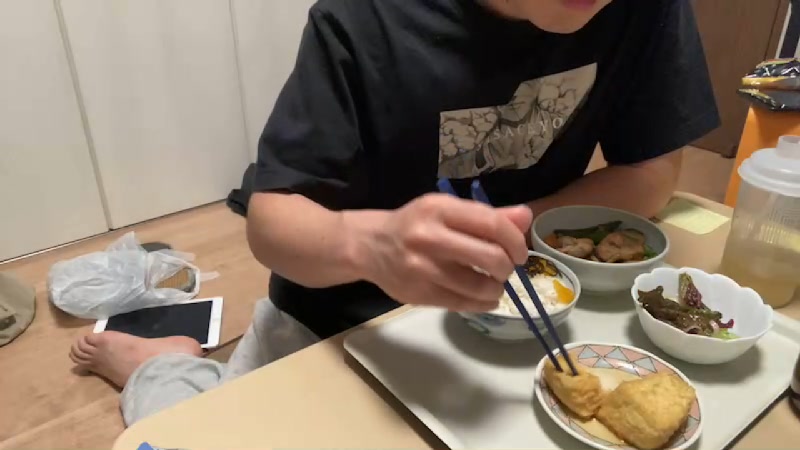
Where is `bowls`? bowls is located at coordinates (612, 363), (528, 287), (602, 234), (746, 340).